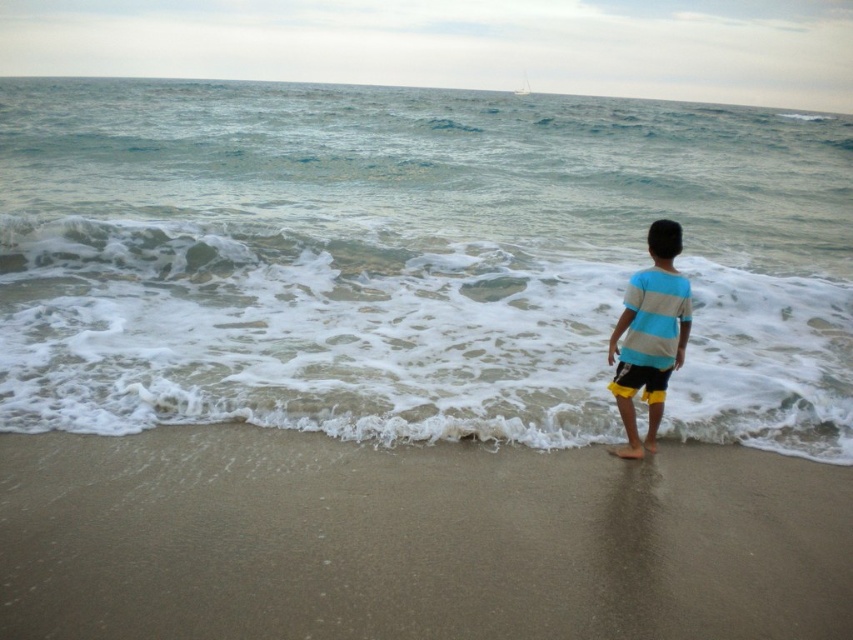
Which is more to the right, clear blue water at center or brown sandy beach at lower center?

From the viewer's perspective, clear blue water at center appears more on the right side.

Identify the location of clear blue water at center. (412, 260).

At what (x,y) coordinates should I click in order to perform the action: click on clear blue water at center. Please return your answer as a coordinate pair (x, y). Image resolution: width=853 pixels, height=640 pixels. Looking at the image, I should click on (x=412, y=260).

Between brown sandy beach at lower center and yellow fabric shorts at lower right, which one is positioned higher?

yellow fabric shorts at lower right is above.

Does brown sandy beach at lower center have a lesser height compared to yellow fabric shorts at lower right?

Incorrect, brown sandy beach at lower center's height does not fall short of yellow fabric shorts at lower right's.

Who is more forward, (683, 472) or (611, 381)?

Point (683, 472) is more forward.

This screenshot has width=853, height=640. I want to click on brown sandy beach at lower center, so click(415, 540).

Is brown sandy beach at lower center above striped cotton shirt at center?

No.

Can you confirm if brown sandy beach at lower center is thinner than striped cotton shirt at center?

No, brown sandy beach at lower center is not thinner than striped cotton shirt at center.

Which is behind, point (126, 627) or point (685, 333)?

Positioned behind is point (685, 333).

Locate an element on the screen. brown sandy beach at lower center is located at coordinates (415, 540).